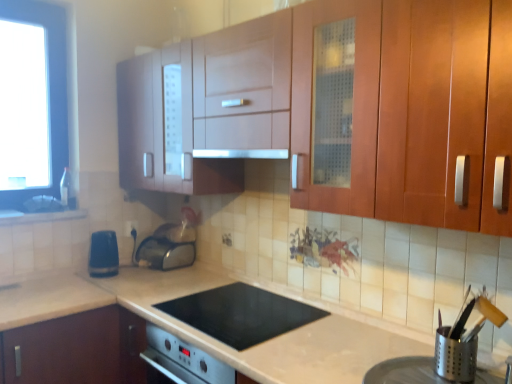
The height and width of the screenshot is (384, 512). In order to click on vacant area in front of blue plastic kettle at lower left, which appears as the 3th appliance when viewed from the front in this screenshot , I will do `click(109, 283)`.